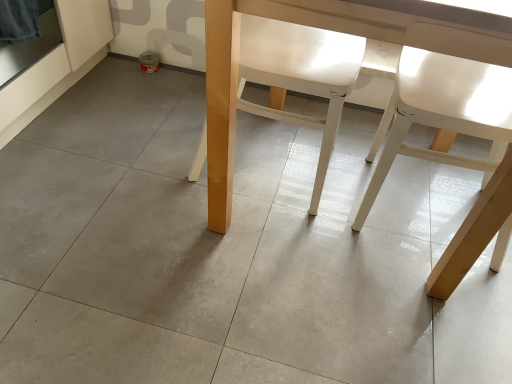
Question: Considering the relative sizes of matte wood table at center and white matte chair at center, the 2th chair viewed from the right, in the image provided, is matte wood table at center wider than white matte chair at center, the 2th chair viewed from the right,?

Choices:
 (A) yes
 (B) no

Answer: (A)

Question: Can you confirm if matte wood table at center is bigger than white matte chair at center, marked as the first chair in a left-to-right arrangement?

Choices:
 (A) no
 (B) yes

Answer: (B)

Question: Can you confirm if matte wood table at center is taller than white matte chair at center, marked as the first chair in a left-to-right arrangement?

Choices:
 (A) no
 (B) yes

Answer: (B)

Question: Is matte wood table at center positioned far away from white matte chair at center, marked as the first chair in a left-to-right arrangement?

Choices:
 (A) no
 (B) yes

Answer: (A)

Question: From the image's perspective, is matte wood table at center on white matte chair at center, the 2th chair viewed from the right?

Choices:
 (A) no
 (B) yes

Answer: (A)

Question: From a real-world perspective, is matte wood table at center beneath white matte chair at center, marked as the first chair in a left-to-right arrangement?

Choices:
 (A) no
 (B) yes

Answer: (A)

Question: Is matte wood table at center at the back of white matte chair at center, marked as the first chair in a left-to-right arrangement?

Choices:
 (A) no
 (B) yes

Answer: (B)

Question: Can you confirm if white matte chair at center, marked as the first chair in a left-to-right arrangement, is smaller than matte wood table at center?

Choices:
 (A) yes
 (B) no

Answer: (A)

Question: Does white matte chair at center, marked as the first chair in a left-to-right arrangement, come behind matte wood table at center?

Choices:
 (A) yes
 (B) no

Answer: (A)

Question: Is white matte chair at center, marked as the first chair in a left-to-right arrangement, touching matte wood table at center?

Choices:
 (A) no
 (B) yes

Answer: (A)

Question: Does white matte chair at center, marked as the first chair in a left-to-right arrangement, turn towards matte wood table at center?

Choices:
 (A) no
 (B) yes

Answer: (B)

Question: Is white matte chair at center, the 2th chair viewed from the right, to the right of matte wood table at center from the viewer's perspective?

Choices:
 (A) yes
 (B) no

Answer: (B)

Question: Is white matte chair at right, the second chair positioned from the left, at the right side of matte wood table at center?

Choices:
 (A) yes
 (B) no

Answer: (A)